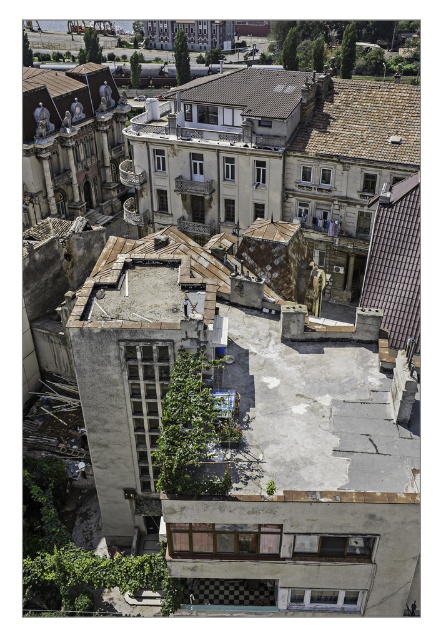
You are a drone operator trying to map the rooftop of the brown tile roof at upper right located at point (363, 124). The drone has a GPS that can only navigate to coordinates with an x value between 0.1 and 0.2. Is the x coordinate of the brown tile roof at upper right within this range?

The brown tile roof at upper right is located at point (363, 124). The x coordinate is 0.195, which is between 0.1 and 0.2, so yes, the x coordinate is within the required range.

You are a drone operator trying to navigate between two brown tiled roofs in the image. The first is the brown tiled roof at upper right and the second is the brown tiled roof at upper center. Which roof is located below the other?

The brown tiled roof at upper right is positioned under the brown tiled roof at upper center, so the brown tiled roof at upper right is below the brown tiled roof at upper center.